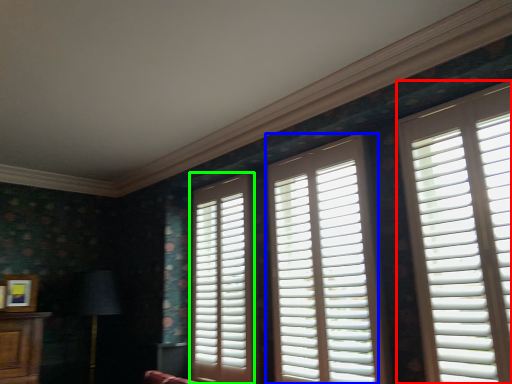
Question: Considering the real-world distances, which object is farthest from window (highlighted by a red box)? window (highlighted by a blue box) or window (highlighted by a green box)?

Choices:
 (A) window
 (B) window

Answer: (B)